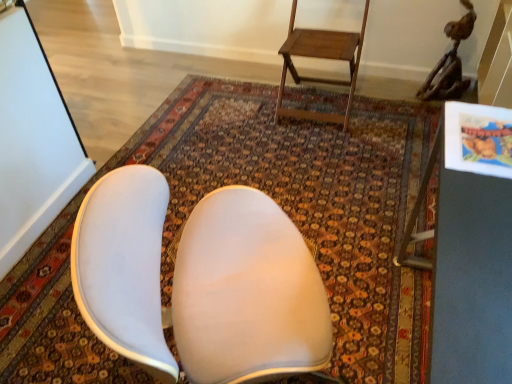
Question: Is carpeted rug at center facing towards wooden step stool at upper center?

Choices:
 (A) yes
 (B) no

Answer: (B)

Question: From a real-world perspective, is carpeted rug at center physically below wooden step stool at upper center?

Choices:
 (A) yes
 (B) no

Answer: (A)

Question: Are carpeted rug at center and wooden step stool at upper center far apart?

Choices:
 (A) no
 (B) yes

Answer: (A)

Question: Is carpeted rug at center turned away from wooden step stool at upper center?

Choices:
 (A) yes
 (B) no

Answer: (B)

Question: Can you confirm if carpeted rug at center is wider than wooden step stool at upper center?

Choices:
 (A) yes
 (B) no

Answer: (A)

Question: Is metallic gray table at right inside the boundaries of carpeted rug at center, or outside?

Choices:
 (A) inside
 (B) outside

Answer: (B)

Question: Is metallic gray table at right bigger or smaller than carpeted rug at center?

Choices:
 (A) small
 (B) big

Answer: (B)

Question: Based on their positions, is metallic gray table at right located to the left or right of carpeted rug at center?

Choices:
 (A) left
 (B) right

Answer: (B)

Question: From a real-world perspective, is metallic gray table at right positioned above or below carpeted rug at center?

Choices:
 (A) below
 (B) above

Answer: (B)

Question: Is metallic gray table at right situated inside wooden step stool at upper center or outside?

Choices:
 (A) inside
 (B) outside

Answer: (B)

Question: Considering the positions of point (437, 278) and point (339, 117), is point (437, 278) closer or farther from the camera than point (339, 117)?

Choices:
 (A) farther
 (B) closer

Answer: (B)

Question: From a real-world perspective, relative to wooden step stool at upper center, is metallic gray table at right vertically above or below?

Choices:
 (A) above
 (B) below

Answer: (A)

Question: From the image's perspective, is metallic gray table at right positioned above or below wooden step stool at upper center?

Choices:
 (A) above
 (B) below

Answer: (B)

Question: Looking at their shapes, would you say wooden step stool at upper center is wider or thinner than metallic gray table at right?

Choices:
 (A) wide
 (B) thin

Answer: (A)

Question: Which is correct: wooden step stool at upper center is inside metallic gray table at right, or outside of it?

Choices:
 (A) outside
 (B) inside

Answer: (A)